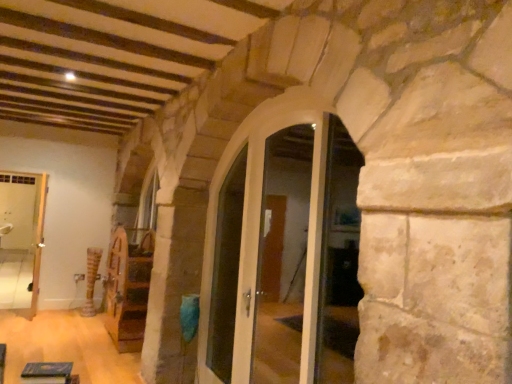
Question: Would you say wooden spinning wheel at center, placed as the first furniture when sorted from bottom to top, is inside or outside white glossy door at center?

Choices:
 (A) inside
 (B) outside

Answer: (B)

Question: Is wooden spinning wheel at center, positioned as the 1th furniture in back-to-front order, bigger or smaller than white glossy door at center?

Choices:
 (A) big
 (B) small

Answer: (A)

Question: Which object is positioned closest to the white glossy door at center, the 1th glass door positioned from the back?

Choices:
 (A) white glossy door at left
 (B) green felt book at lower left, the first furniture positioned from the front
 (C) white glossy door at center
 (D) wooden spinning wheel at center, placed as the first furniture when sorted from bottom to top
 (E) clear glass door at center, which ranks as the second glass door in back-to-front order

Answer: (C)

Question: Which of these objects is positioned farthest from the wooden spinning wheel at center, which is counted as the second furniture, starting from the front?

Choices:
 (A) white glossy door at center
 (B) clear glass door at center, which appears as the 1th glass door when viewed from the front
 (C) wooden textured pillar at center
 (D) white glossy door at left
 (E) white glossy door at center, marked as the 2th glass door in a front-to-back arrangement

Answer: (B)